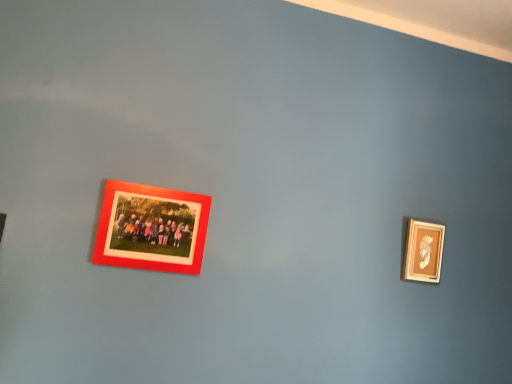
What is the approximate width of wooden gold frame at right, marked as the first picture frame in a right-to-left arrangement?

Result: wooden gold frame at right, marked as the first picture frame in a right-to-left arrangement, is 1.36 inches in width.

The width and height of the screenshot is (512, 384). I want to click on wooden gold frame at right, the 2th picture frame when ordered from left to right, so (x=424, y=251).

The width and height of the screenshot is (512, 384). Describe the element at coordinates (424, 251) in the screenshot. I see `wooden gold frame at right, the 2th picture frame when ordered from left to right` at that location.

What is the approximate height of matte red photo frame at upper left, which is the 2th picture frame from right to left?

The height of matte red photo frame at upper left, which is the 2th picture frame from right to left, is 23.10 centimeters.

This screenshot has height=384, width=512. In order to click on matte red photo frame at upper left, positioned as the 1th picture frame in front-to-back order in this screenshot , I will do `click(151, 228)`.

The width and height of the screenshot is (512, 384). What do you see at coordinates (151, 228) in the screenshot?
I see `matte red photo frame at upper left, the second picture frame viewed from the back` at bounding box center [151, 228].

You are a GUI agent. You are given a task and a screenshot of the screen. Output one action in this format:
    pyautogui.click(x=<x>, y=<y>)
    Task: Click on the wooden gold frame at right, which ranks as the second picture frame in front-to-back order
    The width and height of the screenshot is (512, 384).
    Given the screenshot: What is the action you would take?
    pyautogui.click(x=424, y=251)

Which is more to the right, wooden gold frame at right, which appears as the first picture frame when viewed from the back, or matte red photo frame at upper left, positioned as the 1th picture frame in front-to-back order?

From the viewer's perspective, wooden gold frame at right, which appears as the first picture frame when viewed from the back, appears more on the right side.

Is the depth of wooden gold frame at right, which ranks as the second picture frame in front-to-back order, less than that of matte red photo frame at upper left, marked as the 1th picture frame in a left-to-right arrangement?

No, it is not.

Is point (420, 232) positioned behind point (122, 209)?

Yes.

From the image's perspective, between wooden gold frame at right, which ranks as the second picture frame in front-to-back order, and matte red photo frame at upper left, positioned as the 1th picture frame in front-to-back order, who is located below?

wooden gold frame at right, which ranks as the second picture frame in front-to-back order, from the image's perspective.

From a real-world perspective, which is physically below, wooden gold frame at right, which appears as the first picture frame when viewed from the back, or matte red photo frame at upper left, positioned as the 1th picture frame in front-to-back order?

matte red photo frame at upper left, positioned as the 1th picture frame in front-to-back order.

Can you confirm if wooden gold frame at right, which ranks as the second picture frame in front-to-back order, is thinner than matte red photo frame at upper left, marked as the 1th picture frame in a left-to-right arrangement?

No, wooden gold frame at right, which ranks as the second picture frame in front-to-back order, is not thinner than matte red photo frame at upper left, marked as the 1th picture frame in a left-to-right arrangement.

Which of these two, wooden gold frame at right, marked as the first picture frame in a right-to-left arrangement, or matte red photo frame at upper left, the second picture frame viewed from the back, stands shorter?

With less height is wooden gold frame at right, marked as the first picture frame in a right-to-left arrangement.

Considering the relative sizes of wooden gold frame at right, which appears as the first picture frame when viewed from the back, and matte red photo frame at upper left, positioned as the 1th picture frame in front-to-back order, in the image provided, is wooden gold frame at right, which appears as the first picture frame when viewed from the back, bigger than matte red photo frame at upper left, positioned as the 1th picture frame in front-to-back order,?

Actually, wooden gold frame at right, which appears as the first picture frame when viewed from the back, might be smaller than matte red photo frame at upper left, positioned as the 1th picture frame in front-to-back order.

Is wooden gold frame at right, which ranks as the second picture frame in front-to-back order, outside of matte red photo frame at upper left, the second picture frame viewed from the back?

Yes.

Does wooden gold frame at right, marked as the first picture frame in a right-to-left arrangement, touch matte red photo frame at upper left, which is the 2th picture frame from right to left?

No.

Is wooden gold frame at right, marked as the first picture frame in a right-to-left arrangement, turned away from matte red photo frame at upper left, which is the 2th picture frame from right to left?

wooden gold frame at right, marked as the first picture frame in a right-to-left arrangement, does not have its back to matte red photo frame at upper left, which is the 2th picture frame from right to left.

The height and width of the screenshot is (384, 512). Find the location of `picture frame above the matte red photo frame at upper left, which is the 2th picture frame from right to left (from a real-world perspective)`. picture frame above the matte red photo frame at upper left, which is the 2th picture frame from right to left (from a real-world perspective) is located at coordinates (424, 251).

Visually, is matte red photo frame at upper left, positioned as the 1th picture frame in front-to-back order, positioned to the left or to the right of wooden gold frame at right, which ranks as the second picture frame in front-to-back order?

In the image, matte red photo frame at upper left, positioned as the 1th picture frame in front-to-back order, appears on the left side of wooden gold frame at right, which ranks as the second picture frame in front-to-back order.

Considering the relative positions of matte red photo frame at upper left, marked as the 1th picture frame in a left-to-right arrangement, and wooden gold frame at right, which ranks as the second picture frame in front-to-back order, in the image provided, is matte red photo frame at upper left, marked as the 1th picture frame in a left-to-right arrangement, behind wooden gold frame at right, which ranks as the second picture frame in front-to-back order,?

No, matte red photo frame at upper left, marked as the 1th picture frame in a left-to-right arrangement, is in front of wooden gold frame at right, which ranks as the second picture frame in front-to-back order.

Considering the positions of point (99, 233) and point (431, 251), is point (99, 233) closer or farther from the camera than point (431, 251)?

Clearly, point (99, 233) is closer to the camera than point (431, 251).

From the image's perspective, is matte red photo frame at upper left, positioned as the 1th picture frame in front-to-back order, positioned above or below wooden gold frame at right, marked as the first picture frame in a right-to-left arrangement?

matte red photo frame at upper left, positioned as the 1th picture frame in front-to-back order, is situated higher than wooden gold frame at right, marked as the first picture frame in a right-to-left arrangement, in the image.

From a real-world perspective, is matte red photo frame at upper left, marked as the 1th picture frame in a left-to-right arrangement, on top of wooden gold frame at right, which appears as the first picture frame when viewed from the back?

No, from a real-world perspective, matte red photo frame at upper left, marked as the 1th picture frame in a left-to-right arrangement, is not above wooden gold frame at right, which appears as the first picture frame when viewed from the back.

Does matte red photo frame at upper left, the second picture frame viewed from the back, have a greater width compared to wooden gold frame at right, which appears as the first picture frame when viewed from the back?

No.

Considering the sizes of objects matte red photo frame at upper left, positioned as the 1th picture frame in front-to-back order, and wooden gold frame at right, the 2th picture frame when ordered from left to right, in the image provided, who is shorter, matte red photo frame at upper left, positioned as the 1th picture frame in front-to-back order, or wooden gold frame at right, the 2th picture frame when ordered from left to right,?

With less height is wooden gold frame at right, the 2th picture frame when ordered from left to right.

Considering the sizes of objects matte red photo frame at upper left, which is the 2th picture frame from right to left, and wooden gold frame at right, marked as the first picture frame in a right-to-left arrangement, in the image provided, who is smaller, matte red photo frame at upper left, which is the 2th picture frame from right to left, or wooden gold frame at right, marked as the first picture frame in a right-to-left arrangement,?

wooden gold frame at right, marked as the first picture frame in a right-to-left arrangement, is smaller.

Would you say matte red photo frame at upper left, which is the 2th picture frame from right to left, contains wooden gold frame at right, marked as the first picture frame in a right-to-left arrangement?

No, wooden gold frame at right, marked as the first picture frame in a right-to-left arrangement, is not surrounded by matte red photo frame at upper left, which is the 2th picture frame from right to left.

Is there a large distance between matte red photo frame at upper left, the second picture frame viewed from the back, and wooden gold frame at right, marked as the first picture frame in a right-to-left arrangement?

No.

In the scene shown: Is matte red photo frame at upper left, the second picture frame viewed from the back, looking in the opposite direction of wooden gold frame at right, which ranks as the second picture frame in front-to-back order?

matte red photo frame at upper left, the second picture frame viewed from the back, does not have its back to wooden gold frame at right, which ranks as the second picture frame in front-to-back order.

What's the angular difference between matte red photo frame at upper left, marked as the 1th picture frame in a left-to-right arrangement, and wooden gold frame at right, marked as the first picture frame in a right-to-left arrangement,'s facing directions?

They differ by 1.01 degrees in their facing directions.

Identify the location of picture frame on the right of matte red photo frame at upper left, positioned as the 1th picture frame in front-to-back order. This screenshot has width=512, height=384. (424, 251).

The width and height of the screenshot is (512, 384). I want to click on picture frame above the wooden gold frame at right, which ranks as the second picture frame in front-to-back order (from the image's perspective), so click(151, 228).

Image resolution: width=512 pixels, height=384 pixels. What are the coordinates of `picture frame that appears in front of the wooden gold frame at right, which appears as the first picture frame when viewed from the back` in the screenshot? It's located at (151, 228).